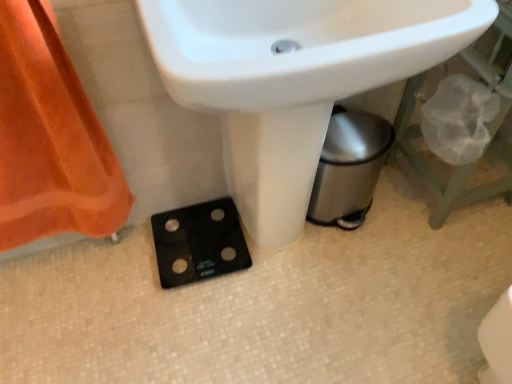
Measure the distance between point (440, 50) and camera.

25.39 inches.

In order to face white glossy sink at center, should I rotate leftwards or rightwards?

Turn right approximately 3.944 degrees to face it.

You are a GUI agent. You are given a task and a screenshot of the screen. Output one action in this format:
    pyautogui.click(x=<x>, y=<y>)
    Task: Click on the black glass scale at lower center
    This screenshot has width=512, height=384.
    Given the screenshot: What is the action you would take?
    pyautogui.click(x=199, y=243)

At what (x,y) coordinates should I click in order to perform the action: click on white glossy sink at center. Please return your answer as a coordinate pair (x, y). The height and width of the screenshot is (384, 512). Looking at the image, I should click on (293, 80).

Based on the photo, from the image's perspective, is black glass scale at lower center above white glossy sink at center?

No, from the image's perspective, black glass scale at lower center is not over white glossy sink at center.

Does black glass scale at lower center appear on the left side of white glossy sink at center?

Yes.

Looking at their sizes, would you say black glass scale at lower center is wider or thinner than white glossy sink at center?

black glass scale at lower center is thinner than white glossy sink at center.

Is point (214, 208) behind point (247, 3)?

Yes, it is behind point (247, 3).

Considering the sizes of orange fabric at left and black glass scale at lower center in the image, is orange fabric at left wider or thinner than black glass scale at lower center?

Clearly, orange fabric at left has less width compared to black glass scale at lower center.

What's the angular difference between orange fabric at left and black glass scale at lower center's facing directions?

There is a 0.632-degree angle between the facing directions of orange fabric at left and black glass scale at lower center.

Considering the relative sizes of orange fabric at left and black glass scale at lower center in the image provided, is orange fabric at left smaller than black glass scale at lower center?

No.

Which of these two, black glass scale at lower center or orange fabric at left, stands shorter?

black glass scale at lower center is shorter.

Which of these two, black glass scale at lower center or orange fabric at left, is wider?

With larger width is black glass scale at lower center.

Which object is further away from the camera, black glass scale at lower center or orange fabric at left?

black glass scale at lower center is further from the camera.

Do you think white glossy sink at center is within orange fabric at left, or outside of it?

white glossy sink at center is not inside orange fabric at left, it's outside.

Does white glossy sink at center lie behind orange fabric at left?

No, white glossy sink at center is closer to the camera.

Would you consider white glossy sink at center to be distant from orange fabric at left?

No, white glossy sink at center is in close proximity to orange fabric at left.

From a real-world perspective, relative to orange fabric at left, is white glossy sink at center vertically above or below?

From a real-world perspective, white glossy sink at center is physically above orange fabric at left.

Does white glossy sink at center contain black glass scale at lower center?

That's incorrect, black glass scale at lower center is not inside white glossy sink at center.

Is white glossy sink at center taller or shorter than black glass scale at lower center?

Clearly, white glossy sink at center is taller compared to black glass scale at lower center.

From the image's perspective, which is above, white glossy sink at center or black glass scale at lower center?

white glossy sink at center is shown above in the image.

Which is closer to the camera, (77,83) or (321,12)?

Point (77,83).

From a real-world perspective, is orange fabric at left above or below white glossy sink at center?

orange fabric at left is below white glossy sink at center.

Between orange fabric at left and white glossy sink at center, which one is positioned in front?

white glossy sink at center is in front.

This screenshot has width=512, height=384. Identify the location of sink on the right of black glass scale at lower center. (293, 80).

Locate an element on the screen. The width and height of the screenshot is (512, 384). curtain on the left of black glass scale at lower center is located at coordinates (50, 138).

When comparing their distances from white glossy sink at center, does black glass scale at lower center or orange fabric at left seem further?

A: orange fabric at left lies further to white glossy sink at center than the other object.

Looking at the image, which one is located further to black glass scale at lower center, white glossy sink at center or orange fabric at left?

Among the two, white glossy sink at center is located further to black glass scale at lower center.

Based on the photo, looking at the image, which one is located further to black glass scale at lower center, orange fabric at left or white glossy sink at center?

Based on the image, white glossy sink at center appears to be further to black glass scale at lower center.

From the image, which object appears to be nearer to white glossy sink at center, orange fabric at left or black glass scale at lower center?

black glass scale at lower center.

Estimate the real-world distances between objects in this image. Which object is further from orange fabric at left, white glossy sink at center or black glass scale at lower center?

white glossy sink at center lies further to orange fabric at left than the other object.

When comparing their distances from orange fabric at left, does black glass scale at lower center or white glossy sink at center seem further?

The object further to orange fabric at left is white glossy sink at center.

Find the location of `curtain between white glossy sink at center and black glass scale at lower center from front to back`. curtain between white glossy sink at center and black glass scale at lower center from front to back is located at coordinates (50, 138).